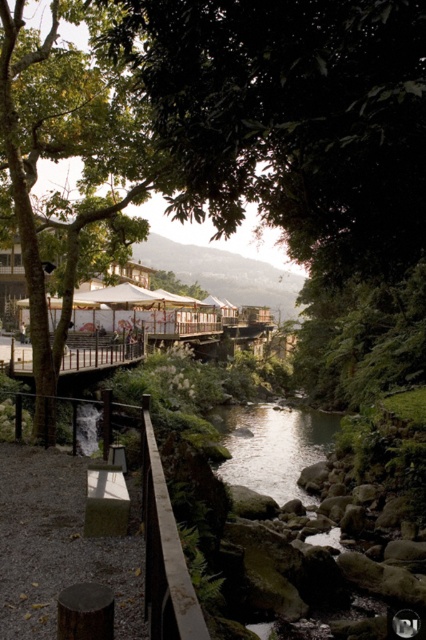
You are a hiker walking along the brown wooden rail at lower left and want to take a photo of the green leafy tree at center. Which direction should you face to get the best view of it?

The green leafy tree at center is positioned on the right side of the brown wooden rail at lower left, so you should face to the right to get the best view of it.

You are a hiker standing on the path near the brown wooden rail at lower left. You want to take a photo of the green leafy tree at center. Which direction should you face to get the best view?

The green leafy tree at center is positioned over the brown wooden rail at lower left, so you should face towards the center of the image to capture the tree in your photo.